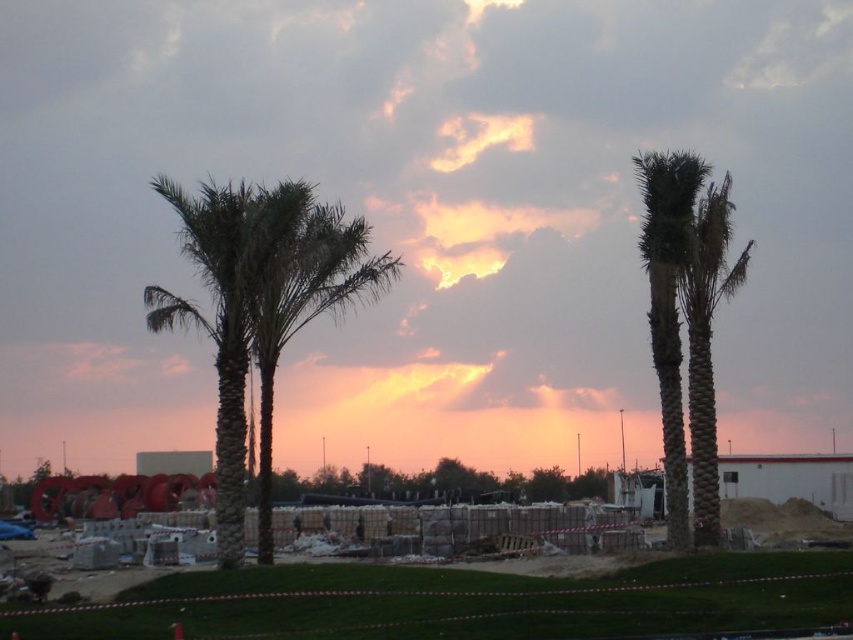
You are a landscape architect designing a garden. You have to place a statue that requires a base larger than the concrete blocks at center. Can the green leafy palm at center provide enough space for the statue base?

The concrete blocks at center is smaller than the green leafy palm at center, so the green leafy palm at center may not provide enough space for the statue base since it is larger than the concrete blocks but the palm itself occupies space.